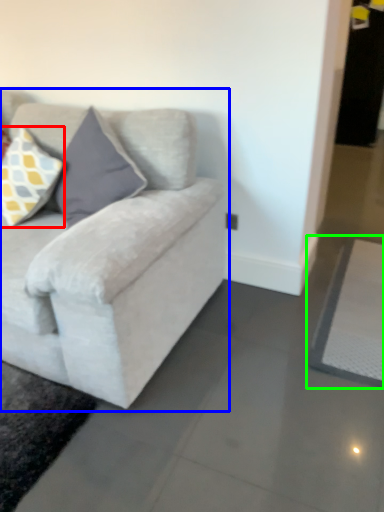
Question: Which object is positioned farthest from pillow (highlighted by a red box)? Select from studio couch (highlighted by a blue box) and yoga mat (highlighted by a green box).

Choices:
 (A) studio couch
 (B) yoga mat

Answer: (B)